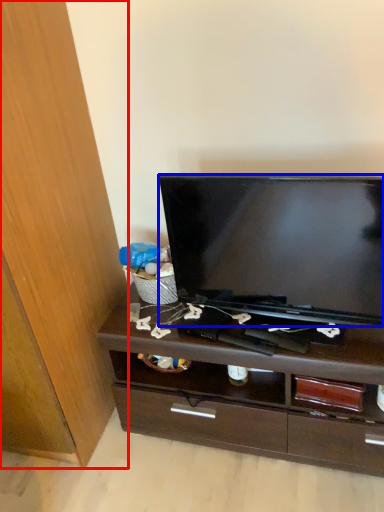
Question: Which object is closer to the camera taking this photo, cabinetry (highlighted by a red box) or television (highlighted by a blue box)?

Choices:
 (A) cabinetry
 (B) television

Answer: (A)